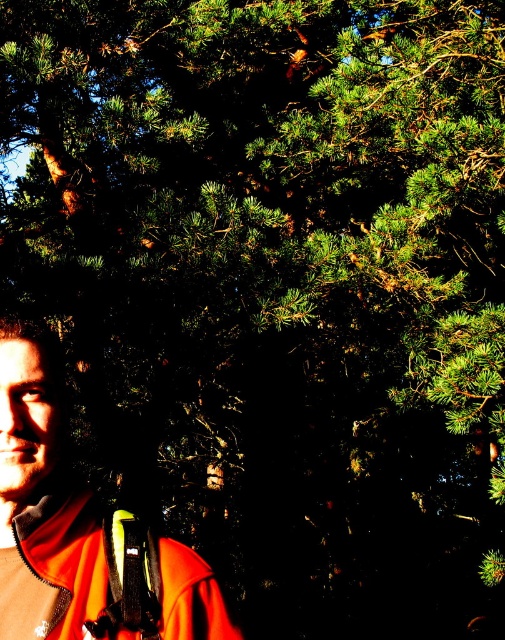
In the scene shown: Does orange fleece jacket at lower left appear on the right side of black matte strap at lower left?

Incorrect, orange fleece jacket at lower left is not on the right side of black matte strap at lower left.

Is point (61, 563) farther from viewer compared to point (145, 524)?

No, (61, 563) is in front of (145, 524).

In order to click on orange fleece jacket at lower left in this screenshot , I will do coord(61,568).

Does orange fabric jacket at left have a lesser width compared to black matte strap at lower left?

In fact, orange fabric jacket at left might be wider than black matte strap at lower left.

Which is in front, point (3, 515) or point (123, 552)?

Point (123, 552) is more forward.

Does point (52, 371) lie behind point (125, 592)?

Yes, point (52, 371) is behind point (125, 592).

What are the coordinates of `orange fabric jacket at left` in the screenshot? It's located at (79, 529).

Does orange fabric jacket at left have a smaller size compared to orange fleece jacket at lower left?

No.

Who is taller, orange fabric jacket at left or orange fleece jacket at lower left?

orange fabric jacket at left is taller.

The height and width of the screenshot is (640, 505). In order to click on orange fabric jacket at left in this screenshot , I will do `click(79, 529)`.